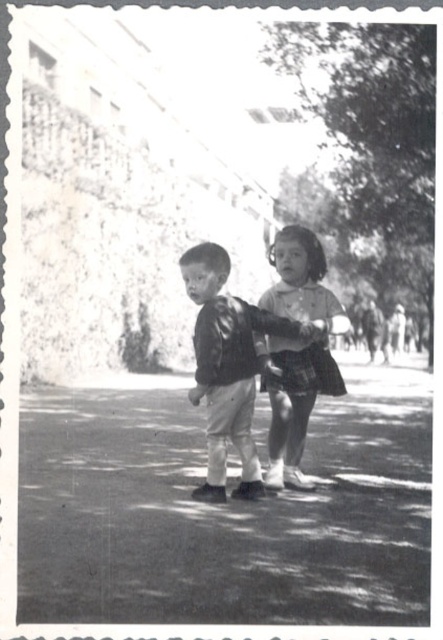
Does leather jacket at center have a lesser height compared to plaid fabric dress at center?

Correct, leather jacket at center is not as tall as plaid fabric dress at center.

Can you confirm if leather jacket at center is wider than plaid fabric dress at center?

Yes, leather jacket at center is wider than plaid fabric dress at center.

What are the coordinates of `leather jacket at center` in the screenshot? It's located at (229, 365).

The height and width of the screenshot is (640, 443). Identify the location of leather jacket at center. (229, 365).